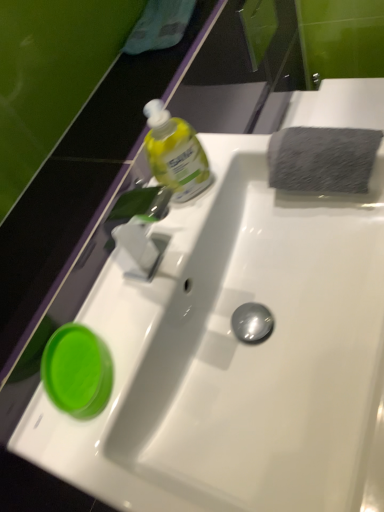
What do you see at coordinates (322, 159) in the screenshot? I see `gray textured sponge at upper right` at bounding box center [322, 159].

Locate an element on the screen. gray textured sponge at upper right is located at coordinates click(322, 159).

Image resolution: width=384 pixels, height=512 pixels. What do you see at coordinates (234, 353) in the screenshot?
I see `white glossy sink at center` at bounding box center [234, 353].

The height and width of the screenshot is (512, 384). Find the location of `gray textured sponge at upper right`. gray textured sponge at upper right is located at coordinates (322, 159).

Who is shorter, white glossy sink at center or green glossy cup at lower left?

With less height is green glossy cup at lower left.

From the image's perspective, is white glossy sink at center below green glossy cup at lower left?

Incorrect, from the image's perspective, white glossy sink at center is higher than green glossy cup at lower left.

Is green glossy cup at lower left at the back of white glossy sink at center?

No, green glossy cup at lower left is not at the back of white glossy sink at center.

Relative to gray textured sponge at upper right, is translucent yellow liquid at upper center in front or behind?

translucent yellow liquid at upper center is in front of gray textured sponge at upper right.

In terms of height, does translucent yellow liquid at upper center look taller or shorter compared to gray textured sponge at upper right?

translucent yellow liquid at upper center is shorter than gray textured sponge at upper right.

Between translucent yellow liquid at upper center and gray textured sponge at upper right, which one has larger width?

With larger width is gray textured sponge at upper right.

From a real-world perspective, is translucent yellow liquid at upper center positioned above or below gray textured sponge at upper right?

translucent yellow liquid at upper center is above gray textured sponge at upper right.

From a real-world perspective, is translucent yellow liquid at upper center below green glossy cup at lower left?

No.

Does translucent yellow liquid at upper center come in front of green glossy cup at lower left?

No.

Visually, is translucent yellow liquid at upper center positioned to the left or to the right of green glossy cup at lower left?

From the image, it's evident that translucent yellow liquid at upper center is to the right of green glossy cup at lower left.

Is translucent yellow liquid at upper center bigger than green glossy cup at lower left?

Yes.

Considering the sizes of white glossy sink at center and translucent yellow liquid at upper center in the image, is white glossy sink at center wider or thinner than translucent yellow liquid at upper center?

white glossy sink at center is wider than translucent yellow liquid at upper center.

Find the location of a particular element. bottle above the white glossy sink at center (from a real-world perspective) is located at coordinates (175, 153).

Is white glossy sink at center completely or partially outside of translucent yellow liquid at upper center?

white glossy sink at center is positioned outside translucent yellow liquid at upper center.

Who is smaller, white glossy sink at center or translucent yellow liquid at upper center?

With smaller size is translucent yellow liquid at upper center.

From the image's perspective, does white glossy sink at center appear higher than gray textured sponge at upper right?

No, from the image's perspective, white glossy sink at center is not above gray textured sponge at upper right.

Is white glossy sink at center outside of gray textured sponge at upper right?

That's correct, white glossy sink at center is outside of gray textured sponge at upper right.

Considering the relative sizes of white glossy sink at center and gray textured sponge at upper right in the image provided, is white glossy sink at center bigger than gray textured sponge at upper right?

Yes.

Does green glossy cup at lower left appear on the right side of gray textured sponge at upper right?

No, green glossy cup at lower left is not to the right of gray textured sponge at upper right.

Is green glossy cup at lower left not close to gray textured sponge at upper right?

No, there isn't a large distance between green glossy cup at lower left and gray textured sponge at upper right.

Is green glossy cup at lower left completely or partially outside of gray textured sponge at upper right?

Absolutely, green glossy cup at lower left is external to gray textured sponge at upper right.

Which is closer, (82, 362) or (324, 170)?

Point (82, 362) appears to be closer to the viewer than point (324, 170).

Considering the sizes of objects green glossy cup at lower left and white glossy sink at center in the image provided, who is bigger, green glossy cup at lower left or white glossy sink at center?

With larger size is white glossy sink at center.

Considering the relative sizes of green glossy cup at lower left and white glossy sink at center in the image provided, is green glossy cup at lower left wider than white glossy sink at center?

No.

Would you say green glossy cup at lower left is a long distance from white glossy sink at center?

green glossy cup at lower left is near white glossy sink at center, not far away.

Considering the sizes of green glossy cup at lower left and white glossy sink at center in the image, is green glossy cup at lower left taller or shorter than white glossy sink at center?

green glossy cup at lower left is shorter than white glossy sink at center.

At what (x,y) coordinates should I click in order to perform the action: click on teal above the white glossy sink at center (from a real-world perspective). Please return your answer as a coordinate pair (x, y). The width and height of the screenshot is (384, 512). Looking at the image, I should click on (77, 371).

Locate an element on the screen. This screenshot has width=384, height=512. hand towel on the right of translucent yellow liquid at upper center is located at coordinates (322, 159).

Estimate the real-world distances between objects in this image. Which object is closer to gray textured sponge at upper right, translucent yellow liquid at upper center or green glossy cup at lower left?

translucent yellow liquid at upper center is closer to gray textured sponge at upper right.

Which object lies nearer to the anchor point translucent yellow liquid at upper center, green glossy cup at lower left or gray textured sponge at upper right?

gray textured sponge at upper right lies closer to translucent yellow liquid at upper center than the other object.

When comparing their distances from green glossy cup at lower left, does translucent yellow liquid at upper center or gray textured sponge at upper right seem closer?

The object closer to green glossy cup at lower left is translucent yellow liquid at upper center.

Which object lies further to the anchor point green glossy cup at lower left, gray textured sponge at upper right or translucent yellow liquid at upper center?

Among the two, gray textured sponge at upper right is located further to green glossy cup at lower left.

Considering their positions, is translucent yellow liquid at upper center positioned closer to green glossy cup at lower left than white glossy sink at center?

white glossy sink at center lies closer to green glossy cup at lower left than the other object.

From the image, which object appears to be nearer to green glossy cup at lower left, white glossy sink at center or gray textured sponge at upper right?

The object closer to green glossy cup at lower left is white glossy sink at center.

Based on the photo, from the image, which object appears to be farther from white glossy sink at center, translucent yellow liquid at upper center or gray textured sponge at upper right?

Based on the image, translucent yellow liquid at upper center appears to be further to white glossy sink at center.

Which object lies nearer to the anchor point translucent yellow liquid at upper center, white glossy sink at center or green glossy cup at lower left?

white glossy sink at center is closer to translucent yellow liquid at upper center.

Find the location of `sink between green glossy cup at lower left and gray textured sponge at upper right in the horizontal direction`. sink between green glossy cup at lower left and gray textured sponge at upper right in the horizontal direction is located at coordinates click(234, 353).

The image size is (384, 512). Identify the location of bottle located between white glossy sink at center and gray textured sponge at upper right in the depth direction. (175, 153).

Locate an element on the screen. bottle between green glossy cup at lower left and gray textured sponge at upper right from left to right is located at coordinates (175, 153).

Locate an element on the screen. The width and height of the screenshot is (384, 512). sink between translucent yellow liquid at upper center and green glossy cup at lower left in the up-down direction is located at coordinates (234, 353).